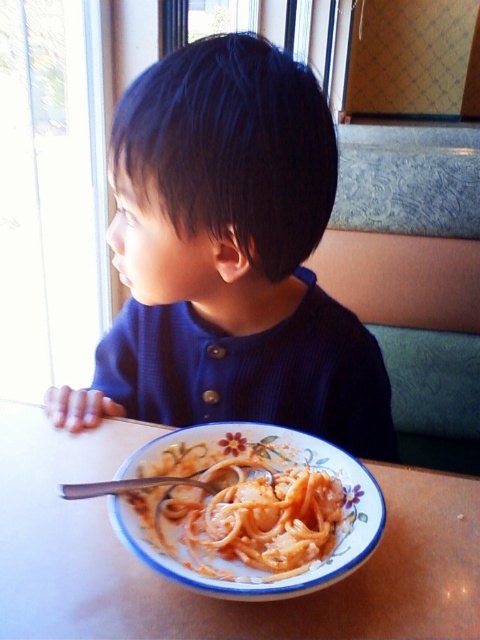
Question: Which point is farther from the camera taking this photo?

Choices:
 (A) (256, 470)
 (B) (178, 164)

Answer: (A)

Question: Which point appears farthest from the camera in this image?

Choices:
 (A) (193, 129)
 (B) (81, 484)
 (C) (261, 472)

Answer: (C)

Question: Does dark blue sweater at upper left have a smaller size compared to white glossy table at lower center?

Choices:
 (A) yes
 (B) no

Answer: (B)

Question: Is dark blue sweater at upper left above silver metallic fork at lower center?

Choices:
 (A) yes
 (B) no

Answer: (A)

Question: Which object is farther from the camera taking this photo?

Choices:
 (A) white glossy table at lower center
 (B) silver metallic fork at lower center
 (C) dark blue sweater at upper left
 (D) creamy matte pasta at lower center

Answer: (B)

Question: Is creamy matte pasta at lower center positioned at the back of silver metallic fork at lower center?

Choices:
 (A) yes
 (B) no

Answer: (B)